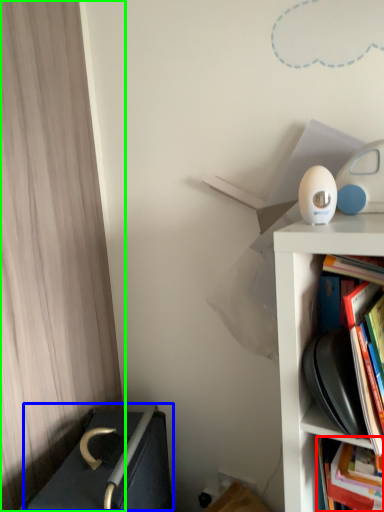
Question: Based on their relative distances, which object is nearer to book (highlighted by a red box)? Choose from writing (highlighted by a blue box) and curtain (highlighted by a green box).

Choices:
 (A) writing
 (B) curtain

Answer: (A)